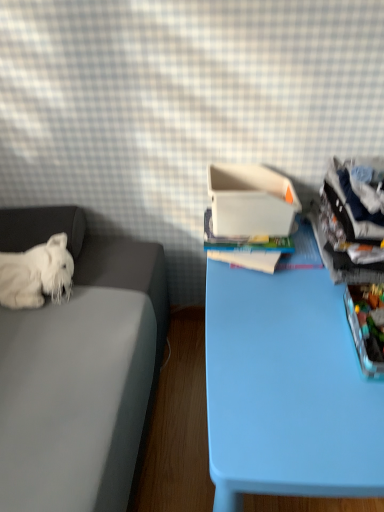
Find the location of a particular element. The image size is (384, 512). vacant space to the left of translucent plastic storage box at right is located at coordinates (288, 345).